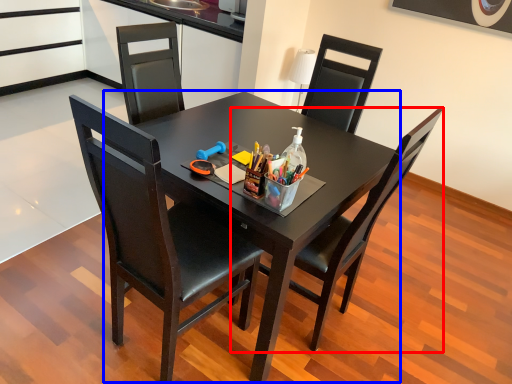
Question: Which of the following is the farthest to the observer, chair (highlighted by a red box) or round table (highlighted by a blue box)?

Choices:
 (A) chair
 (B) round table

Answer: (B)